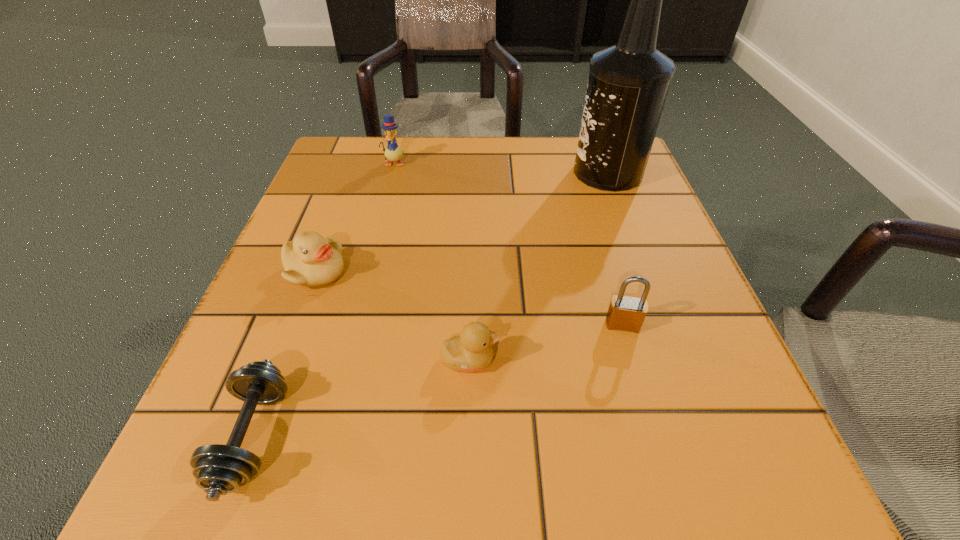
Locate an element on the screen. The height and width of the screenshot is (540, 960). free space between the padlock and the dumbbell is located at coordinates (438, 381).

Where is `blank region between the liquor and the farthest duckling`? This screenshot has width=960, height=540. blank region between the liquor and the farthest duckling is located at coordinates (501, 168).

Find the location of a particular element. The width and height of the screenshot is (960, 540). unoccupied area between the tallest object and the second farthest duckling is located at coordinates (461, 222).

This screenshot has height=540, width=960. Find the location of `object that stands as the second closest to the leftmost duckling`. object that stands as the second closest to the leftmost duckling is located at coordinates (471, 351).

Find the location of a particular element. This screenshot has width=960, height=540. the fourth closest object to the tallest object is located at coordinates (310, 260).

Image resolution: width=960 pixels, height=540 pixels. In order to click on the second closest duckling to the nearest duckling in this screenshot , I will do `click(392, 152)`.

Identify the location of duckling that is the second closest to the fourth object from left to right. The image size is (960, 540). (392, 152).

This screenshot has height=540, width=960. What are the coordinates of `free space in the image that satisfies the following two spatial constraints: 1. on the back side of the padlock; 2. on the beak of the leftmost duckling` in the screenshot? It's located at (608, 272).

This screenshot has height=540, width=960. Find the location of `blank space that satisfies the following two spatial constraints: 1. on the beak of the fourth nearest object; 2. on the right side of the third nearest object`. blank space that satisfies the following two spatial constraints: 1. on the beak of the fourth nearest object; 2. on the right side of the third nearest object is located at coordinates (296, 325).

Image resolution: width=960 pixels, height=540 pixels. What are the coordinates of `vacant position in the image that satisfies the following two spatial constraints: 1. on the back side of the padlock; 2. on the right side of the dumbbell` in the screenshot? It's located at (296, 325).